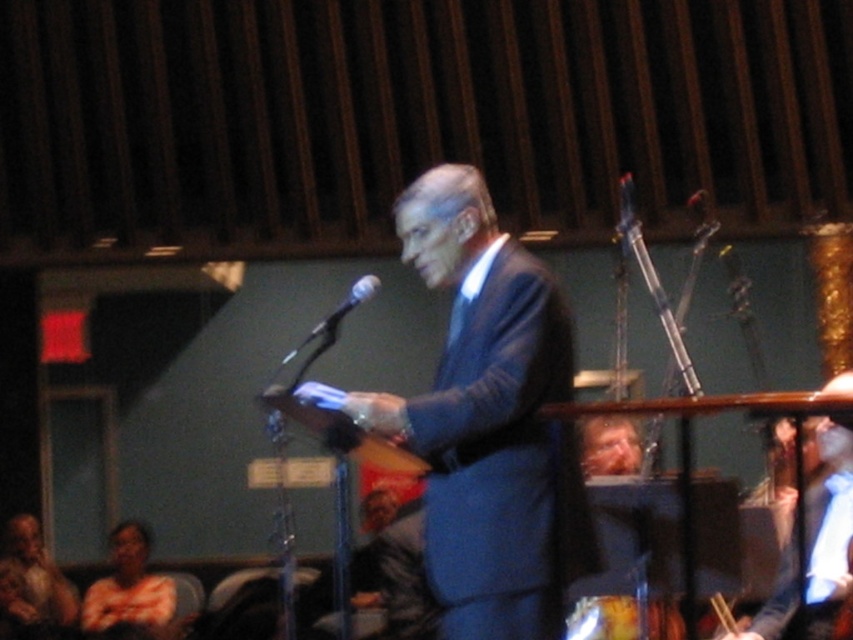
Please answer based on the coordinates provided. The blue suit at center is represented by point (x=489, y=420). If the stage is a rectangle with coordinates from 0.0 to 1.0 on both axes, where is the blue suit at center located relative to the stage?

The blue suit at center is located at the center of the stage since its coordinates are (x=489, y=420), which is near the middle of the stage area.